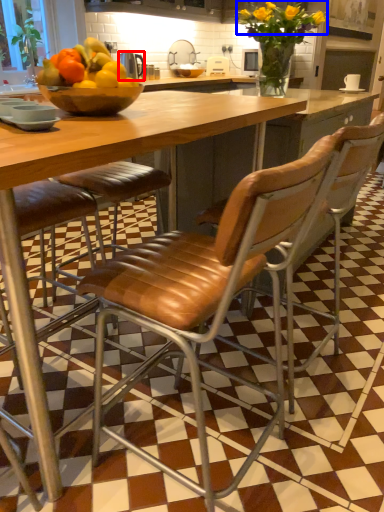
Question: Which point is further to the camera, appliance (highlighted by a red box) or flower (highlighted by a blue box)?

Choices:
 (A) appliance
 (B) flower

Answer: (B)